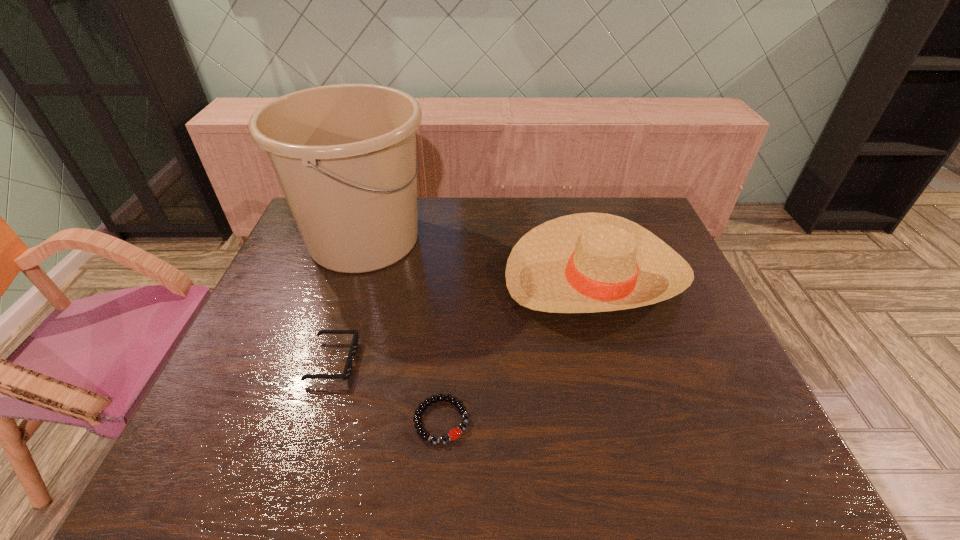
You are a GUI agent. You are given a task and a screenshot of the screen. Output one action in this format:
    pyautogui.click(x=<x>, y=<y>)
    Task: Click on the free space between the nearest object and the sunhat
    
    Given the screenshot: What is the action you would take?
    pyautogui.click(x=518, y=348)

Locate an element on the screen. free area in between the shortest object and the tallest object is located at coordinates (403, 330).

I want to click on free spot between the sunhat and the tallest object, so click(x=480, y=257).

Find the location of `empty space between the bracelet and the second shortest object`. empty space between the bracelet and the second shortest object is located at coordinates point(387,391).

Image resolution: width=960 pixels, height=540 pixels. In order to click on the closest object to the third tallest object in this screenshot , I will do `click(453, 434)`.

Image resolution: width=960 pixels, height=540 pixels. In order to click on object that is the closest one to the bracelet in this screenshot , I will do `click(346, 374)`.

Where is `free location that satisfies the following two spatial constraints: 1. on the front-facing side of the bracelet; 2. on the right side of the third tallest object`? This screenshot has height=540, width=960. free location that satisfies the following two spatial constraints: 1. on the front-facing side of the bracelet; 2. on the right side of the third tallest object is located at coordinates (315, 421).

The width and height of the screenshot is (960, 540). In order to click on vacant region that satisfies the following two spatial constraints: 1. on the front side of the nearest object; 2. on the right side of the tallest object in this screenshot , I will do `click(306, 421)`.

Identify the location of free space that satisfies the following two spatial constraints: 1. on the front side of the bucket; 2. on the right side of the second object from right to left. This screenshot has height=540, width=960. (306, 421).

In order to click on vacant space that satisfies the following two spatial constraints: 1. on the front side of the third shortest object; 2. on the front-facing side of the sunglasses in this screenshot , I will do pos(620,361).